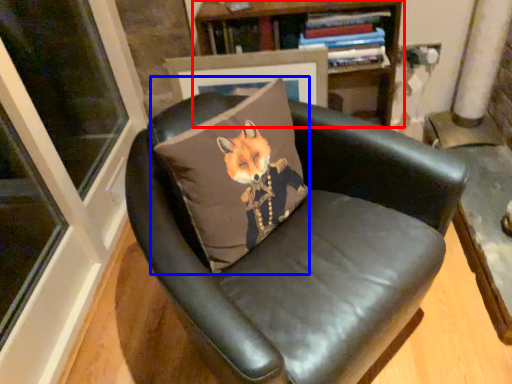
Question: Which of the following is the closest to the observer, bookcase (highlighted by a red box) or throw pillow (highlighted by a blue box)?

Choices:
 (A) bookcase
 (B) throw pillow

Answer: (B)